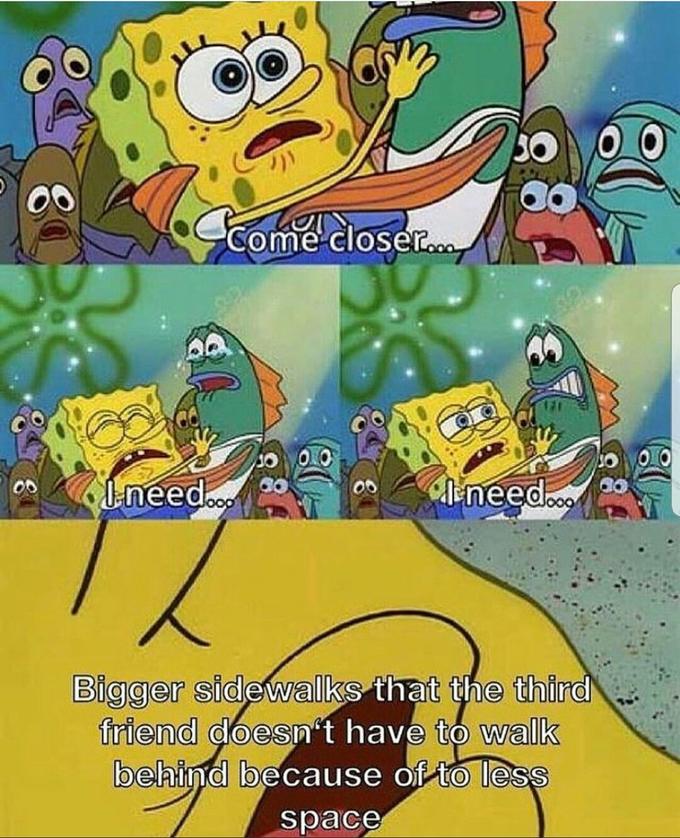
The height and width of the screenshot is (838, 680). Identify the location of sponge. (126, 443).